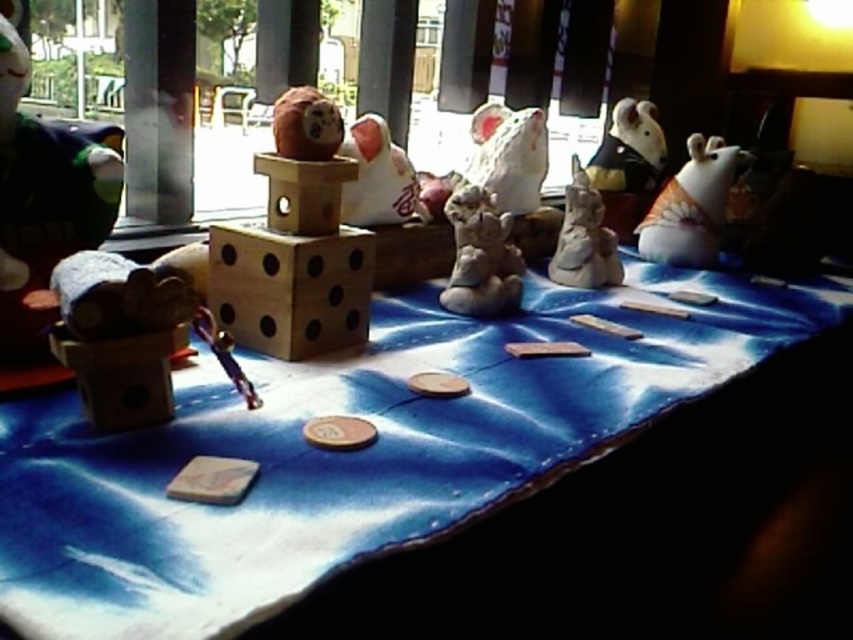
Question: Estimate the real-world distances between objects in this image. Which object is farther from the white glossy bear at center?

Choices:
 (A) white glossy statue at center
 (B) white glossy bear at upper right
 (C) matte brown bear at left

Answer: (B)

Question: Is white glossy bear at center bigger than white glossy statue at center?

Choices:
 (A) no
 (B) yes

Answer: (A)

Question: Which point appears farthest from the camera in this image?

Choices:
 (A) (36, 248)
 (B) (477, 230)

Answer: (B)

Question: Which of the following is the farthest from the observer?

Choices:
 (A) matte brown bear at left
 (B) blue fabric table at center
 (C) white glossy statue at center

Answer: (C)

Question: Does white glossy bear at upper right come in front of white glossy bear at center?

Choices:
 (A) no
 (B) yes

Answer: (A)

Question: Can you confirm if white glossy bear at upper right is smaller than white glossy statue at center?

Choices:
 (A) yes
 (B) no

Answer: (B)